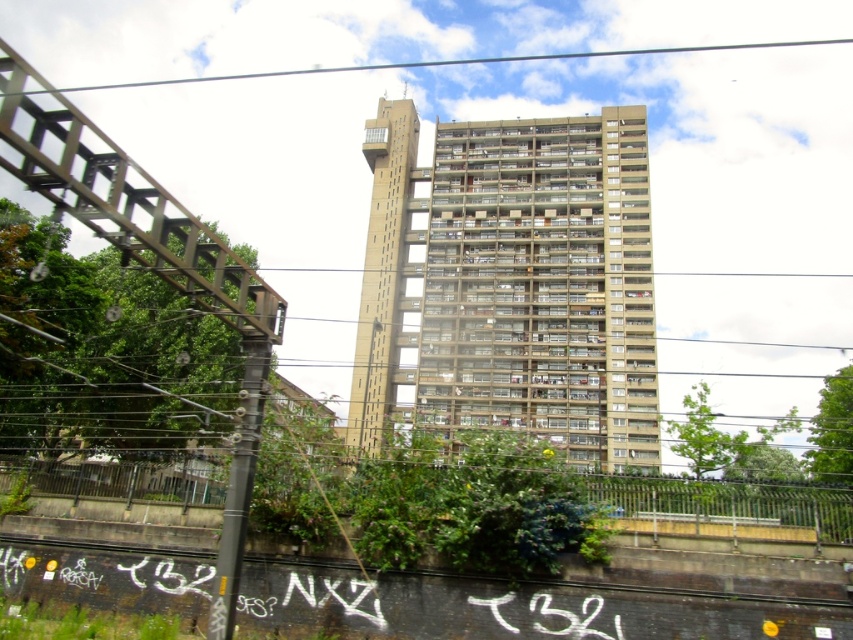
Does beige concrete tower block at center appear over black wire at upper center?

No.

Is point (474, 225) positioned behind point (630, 49)?

No, (474, 225) is in front of (630, 49).

Where is `beige concrete tower block at center`? Image resolution: width=853 pixels, height=640 pixels. beige concrete tower block at center is located at coordinates click(x=509, y=284).

This screenshot has width=853, height=640. I want to click on beige concrete tower block at center, so 509,284.